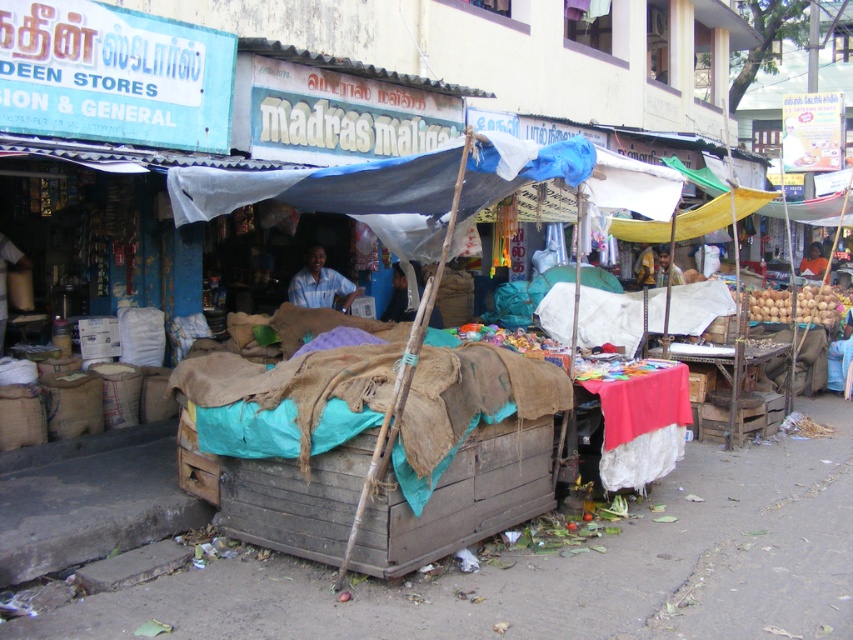
What is the spatial relationship between the brown wooden crate at lower center and the blue fabric at center in the market scene?

The brown wooden crate at lower center is positioned to the left of the blue fabric at center.